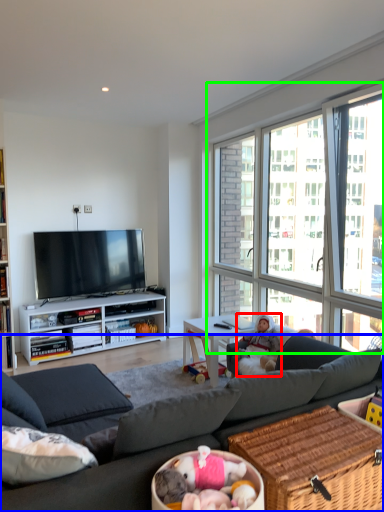
Question: Which object is the farthest from person (highlighted by a red box)? Choose among these: studio couch (highlighted by a blue box) or window (highlighted by a green box).

Choices:
 (A) studio couch
 (B) window

Answer: (A)